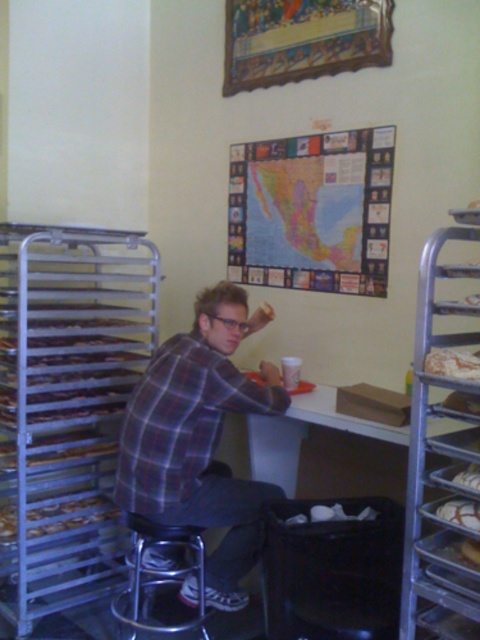
Question: Which of the following is the farthest from the observer?

Choices:
 (A) (129, 493)
 (B) (35, 512)
 (C) (280, 282)
 (D) (456, 509)

Answer: (C)

Question: Can you confirm if mappaperbulletin board at upper center is positioned to the right of slightly browned bread at right?

Choices:
 (A) yes
 (B) no

Answer: (B)

Question: Can you confirm if metallic silver bar stool at lower left is thinner than golden brown pastry at left?

Choices:
 (A) no
 (B) yes

Answer: (B)

Question: Estimate the real-world distances between objects in this image. Which object is farther from the baked golden bread at right?

Choices:
 (A) white glossy bread at right
 (B) mappaperbulletin board at upper center
 (C) white matte table at center

Answer: (B)

Question: Can you confirm if mappaperbulletin board at upper center is smaller than metallic silver bar stool at lower left?

Choices:
 (A) no
 (B) yes

Answer: (A)

Question: Among these objects, which one is nearest to the camera?

Choices:
 (A) mappaperbulletin board at upper center
 (B) plaid shirt at center
 (C) slightly browned bread at right

Answer: (C)